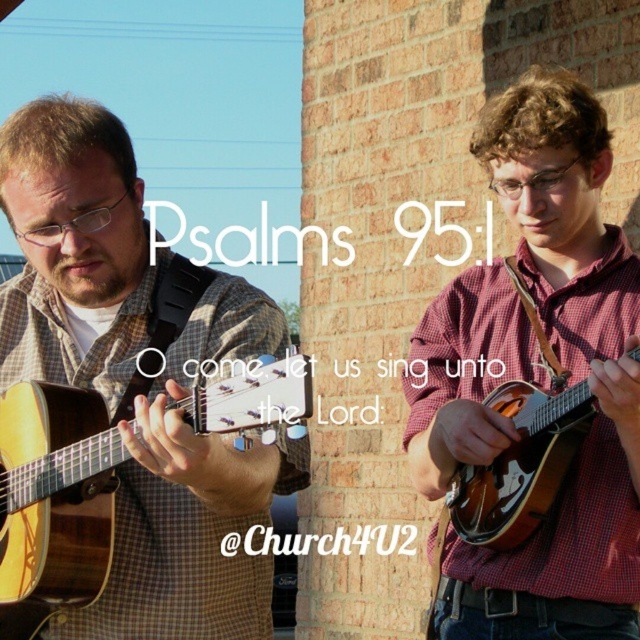
Question: Is matte brown mandolin at right positioned at the back of wooden mandolin at right?

Choices:
 (A) no
 (B) yes

Answer: (B)

Question: Which point is closer to the camera?

Choices:
 (A) click(x=525, y=509)
 (B) click(x=616, y=554)

Answer: (A)

Question: Which point is closer to the camera?

Choices:
 (A) (512, 595)
 (B) (496, 509)
 (C) (35, 508)

Answer: (C)

Question: Does acoustic wood guitar at left lie behind wooden mandolin at right?

Choices:
 (A) yes
 (B) no

Answer: (B)

Question: Among these objects, which one is farthest from the camera?

Choices:
 (A) acoustic wood guitar at left
 (B) wooden mandolin at right

Answer: (B)

Question: In this image, where is matte brown mandolin at right located relative to wooden mandolin at right?

Choices:
 (A) below
 (B) above

Answer: (A)